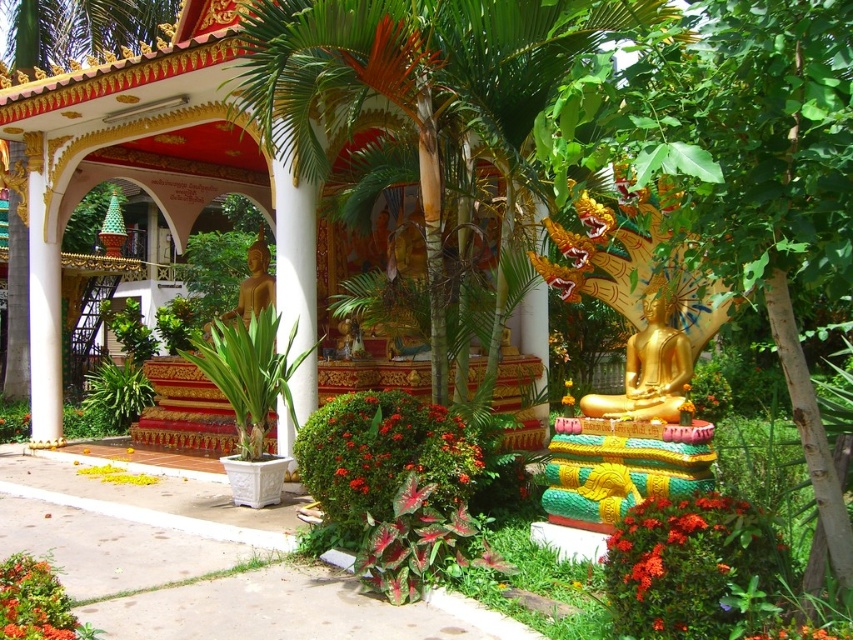
You are standing at the entrance of the temple and want to place a small offering at the base of the golden Buddha statue. Given the green leafy palm tree at center, can you determine the direction you should walk from the entrance to reach the statue?

The green leafy palm tree at center is located at point (418, 100), which is near the center of the temple. To reach the golden Buddha statue, you should walk towards the area where the statue is positioned, which is likely in the central part of the temple near the palm tree.

You are a temple visitor standing at the entrance of the temple. You want to walk from the entrance to the bright orange flowers at lower right without getting too close to the green leafy palm tree at center. Can you do it? Please explain your reasoning.

The green leafy palm tree at center is 3.70 meters away from the bright orange flowers at lower right. Since the distance between them is 3.70 meters, you can walk around the green leafy palm tree at center to reach the bright orange flowers at lower right without getting too close.